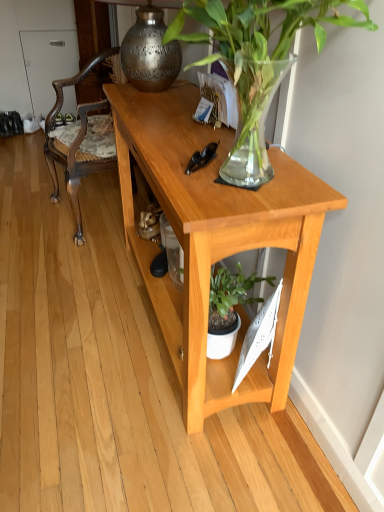
You are a GUI agent. You are given a task and a screenshot of the screen. Output one action in this format:
    pyautogui.click(x=<x>, y=<y>)
    Task: Click on the free spot to the left of light wood desk at center
    This screenshot has width=384, height=512.
    Given the screenshot: What is the action you would take?
    pyautogui.click(x=67, y=311)